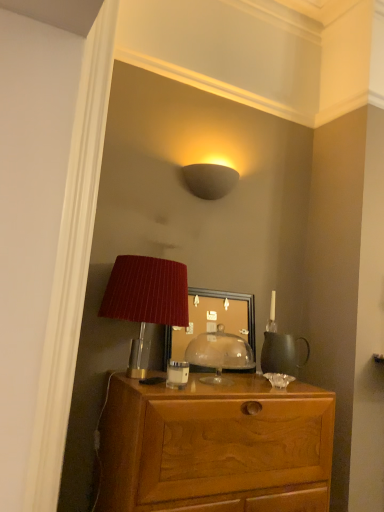
The image size is (384, 512). What are the coordinates of `free location above matte red lampshade at center (from a real-world perspective)` in the screenshot? It's located at (226, 324).